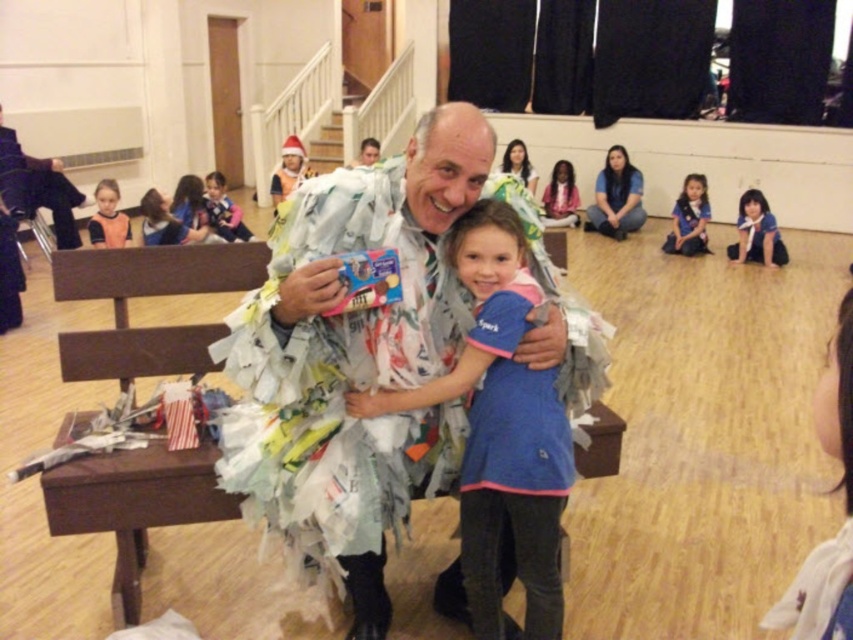
Please look at the image. There is a point marked at coordinates (108,218). What is located at that point?

The point at coordinates (108,218) marks the location of the light brown hair at upper left.

You are standing in the community hall and need to place a 32 inch long decoration between the light brown hair at upper left and the matte white shirt at center. Will the decoration fit between them?

The distance between the light brown hair at upper left and the matte white shirt at center is 31.92 inches. Since the decoration is 32 inches long, it will not fit between them as it is slightly longer than the available space.

You are a photographer positioned at the bottom of the staircase. You need to capture a photo of both the white paper costume at center and the matte white shirt at center in the same frame. Given that your camera has a maximum focus range of 5 meters, will you be able to capture both subjects clearly in the photo?

The distance between the white paper costume at center and the matte white shirt at center is 4.93 meters, which is within the camera maximum focus range of 5 meters. Therefore, both subjects can be captured clearly in the same frame.